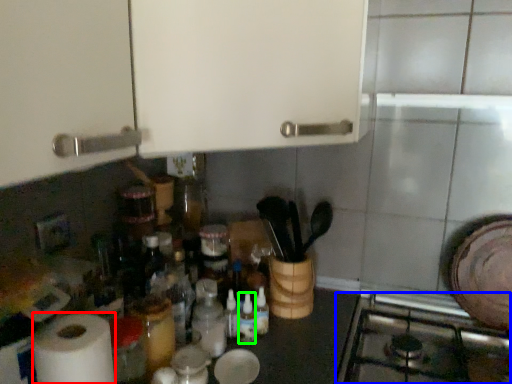
Question: Based on their relative distances, which object is nearer to paper towel (highlighted by a red box)? Choose from gas stove (highlighted by a blue box) and bottle (highlighted by a green box).

Choices:
 (A) gas stove
 (B) bottle

Answer: (B)